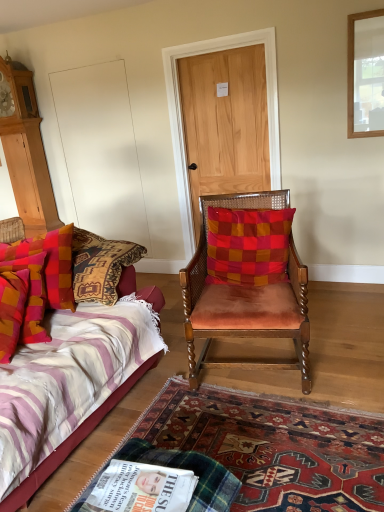
Question: In the image, is light brown wood door at center on the left side or the right side of red checkered cushion at center, which ranks as the first pillow in right-to-left order?

Choices:
 (A) right
 (B) left

Answer: (B)

Question: From a real-world perspective, is light brown wood door at center above or below red checkered cushion at center, which ranks as the first pillow in right-to-left order?

Choices:
 (A) below
 (B) above

Answer: (B)

Question: Considering the real-world distances, which object is closest to the velvet striped bed at left?

Choices:
 (A) velvet orange chair at center
 (B) white glossy magazine at lower center
 (C) light brown wood door at center
 (D) carpeted rug at lower center
 (E) plaid fabric pillow at left, positioned as the first pillow in left-to-right order

Answer: (E)

Question: Estimate the real-world distances between objects in this image. Which object is farther from the plaid fabric pillow at left, positioned as the first pillow in left-to-right order?

Choices:
 (A) velvet orange chair at center
 (B) carpeted rug at lower center
 (C) light brown wood door at center
 (D) white glossy magazine at lower center
 (E) red checkered cushion at center, which is the second pillow from left to right

Answer: (C)